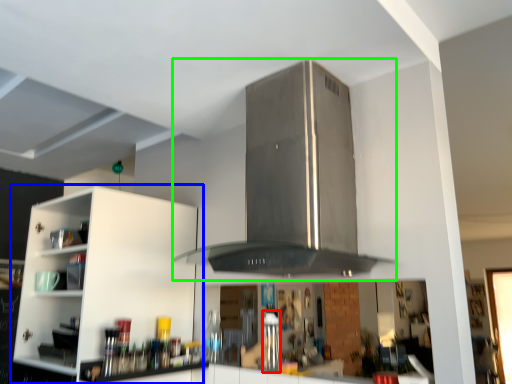
Question: Which object is the farthest from appliance (highlighted by a red box)? Choose among these: cabinetry (highlighted by a blue box) or vent (highlighted by a green box).

Choices:
 (A) cabinetry
 (B) vent

Answer: (A)